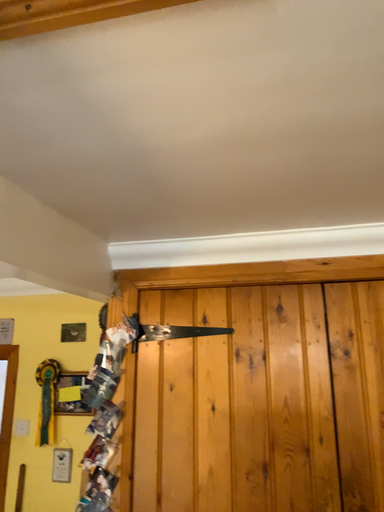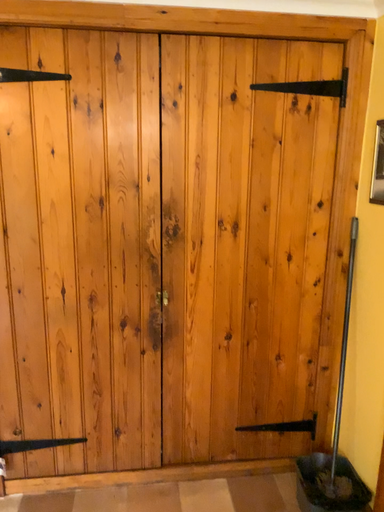
Question: How did the camera likely rotate when shooting the video?

Choices:
 (A) rotated upward
 (B) rotated downward

Answer: (B)